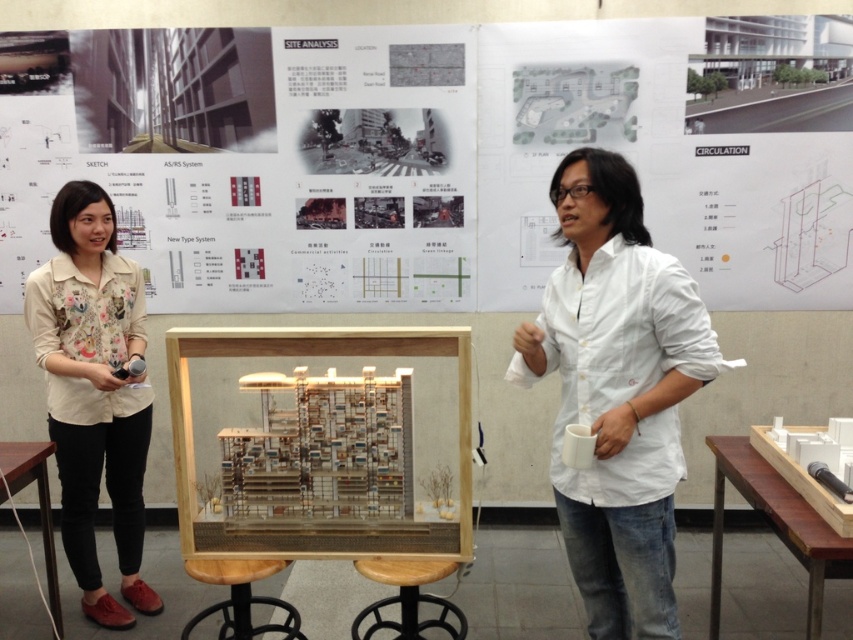
Question: Which point is farther to the camera?

Choices:
 (A) white paper poster at upper center
 (B) floral-patterned shirt at left
 (C) white matte shirt at center

Answer: (A)

Question: Which object is closer to the camera taking this photo?

Choices:
 (A) floral-patterned shirt at left
 (B) white matte shirt at center
 (C) white paper poster at upper center
 (D) transparent glass model at center

Answer: (B)

Question: Observing the image, what is the correct spatial positioning of white paper poster at upper center in reference to floral-patterned shirt at left?

Choices:
 (A) right
 (B) left

Answer: (A)

Question: Is white matte shirt at center positioned behind floral-patterned shirt at left?

Choices:
 (A) yes
 (B) no

Answer: (B)

Question: Can you confirm if white paper poster at upper center is positioned to the right of transparent glass model at center?

Choices:
 (A) no
 (B) yes

Answer: (B)

Question: Which object is farther from the camera taking this photo?

Choices:
 (A) transparent glass model at center
 (B) floral-patterned shirt at left
 (C) white paper poster at upper center

Answer: (C)